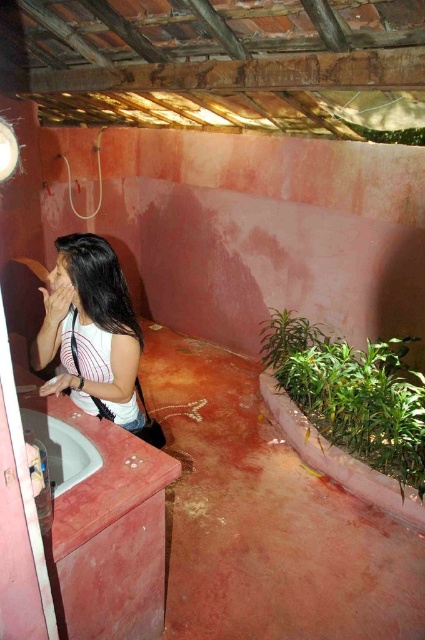
Which is more to the left, white striped shirt at left or white glossy sink at lower left?

Positioned to the left is white glossy sink at lower left.

The width and height of the screenshot is (425, 640). What do you see at coordinates (95, 333) in the screenshot?
I see `white striped shirt at left` at bounding box center [95, 333].

This screenshot has width=425, height=640. In order to click on white striped shirt at left in this screenshot , I will do 95,333.